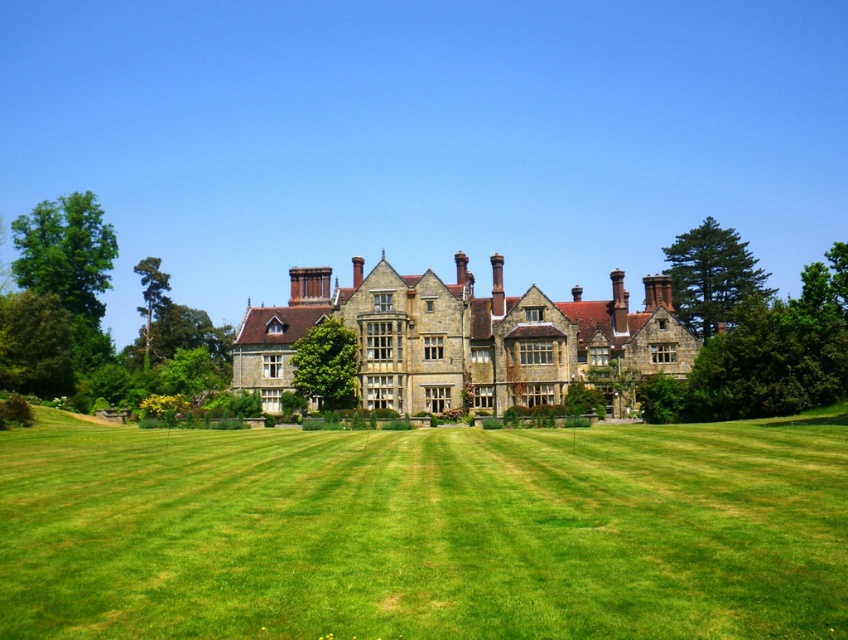
Question: Which of the following is the farthest from the observer?

Choices:
 (A) (12, 598)
 (B) (448, 285)

Answer: (B)

Question: Does green grass at center appear under stone brick mansion at center?

Choices:
 (A) yes
 (B) no

Answer: (A)

Question: Which of the following is the farthest from the observer?

Choices:
 (A) (244, 444)
 (B) (500, 387)

Answer: (B)

Question: Is green grass at center above stone brick mansion at center?

Choices:
 (A) no
 (B) yes

Answer: (A)

Question: Can you confirm if green grass at center is wider than stone brick mansion at center?

Choices:
 (A) no
 (B) yes

Answer: (B)